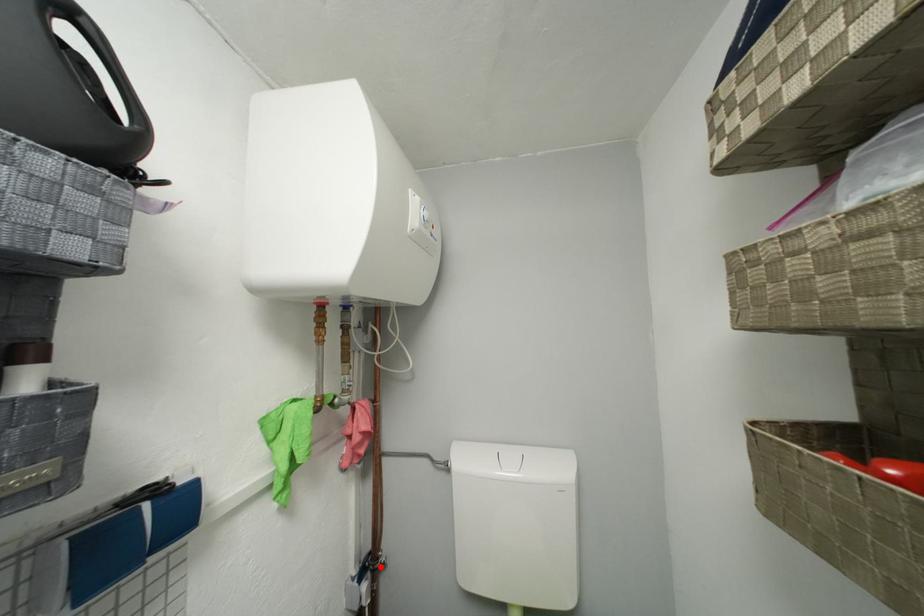
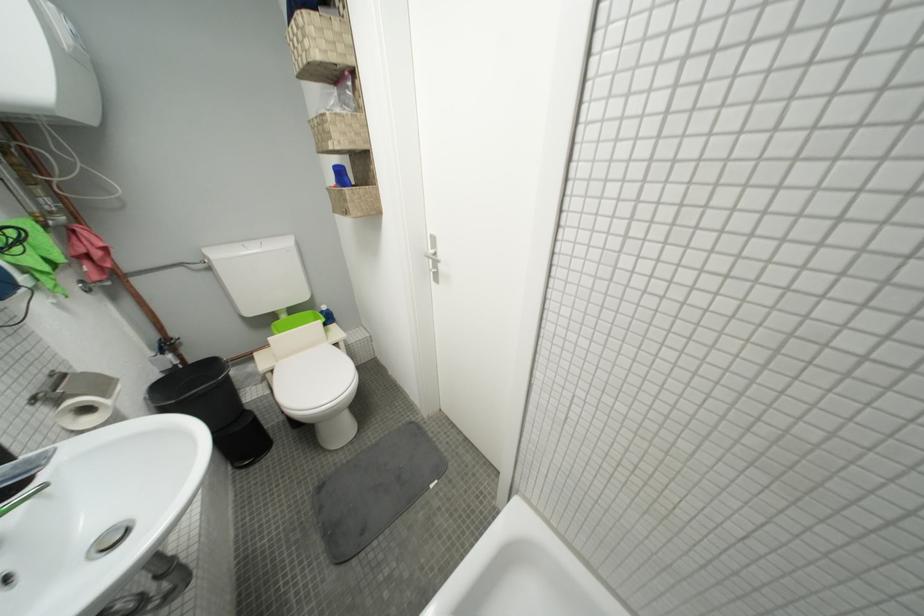
In the second image, find the point that corresponds to the highlighted location in the first image.

(175, 347)